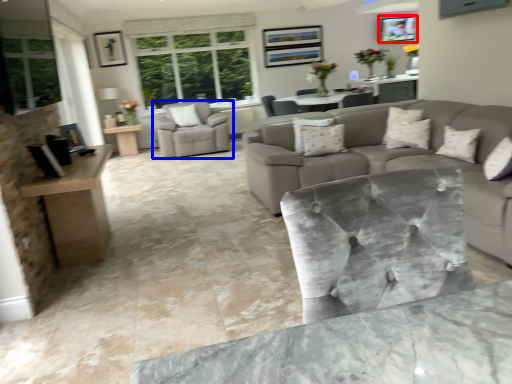
Question: Among these objects, which one is farthest to the camera, picture frame (highlighted by a red box) or chair (highlighted by a blue box)?

Choices:
 (A) picture frame
 (B) chair

Answer: (A)